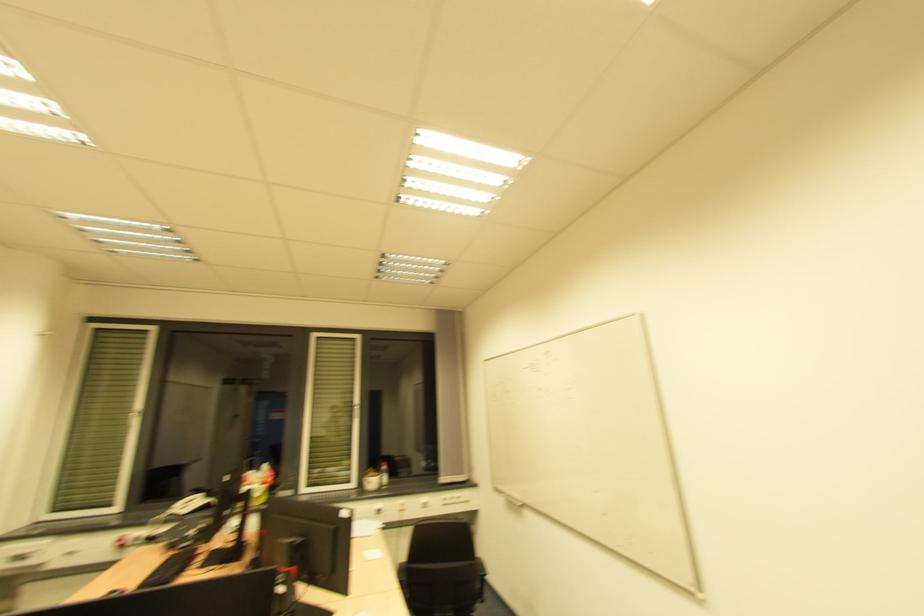
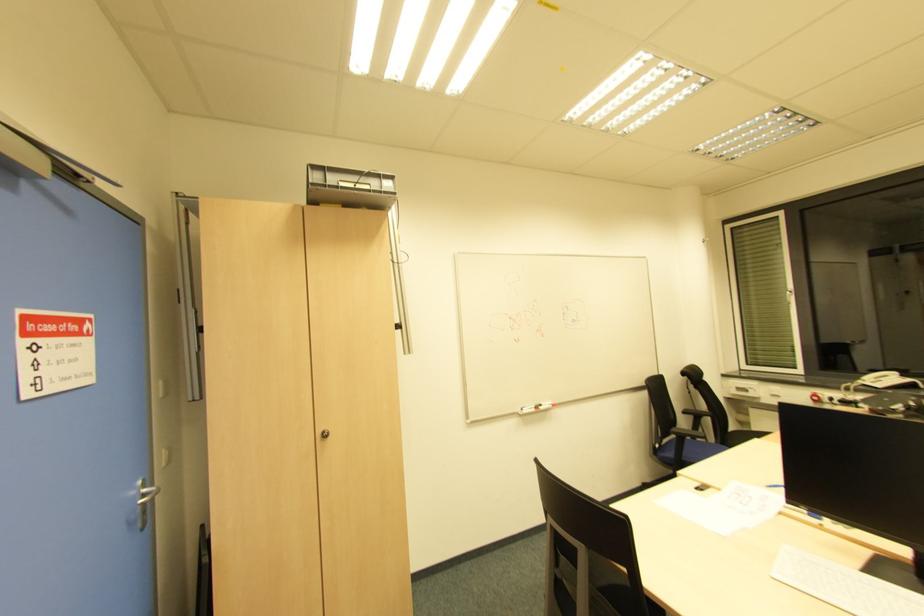
Question: The camera is either moving clockwise (left) or counter-clockwise (right) around the object. The first image is from the beginning of the video and the second image is from the end. Is the camera moving left or right when shooting the video?

Choices:
 (A) Left
 (B) Right

Answer: (B)